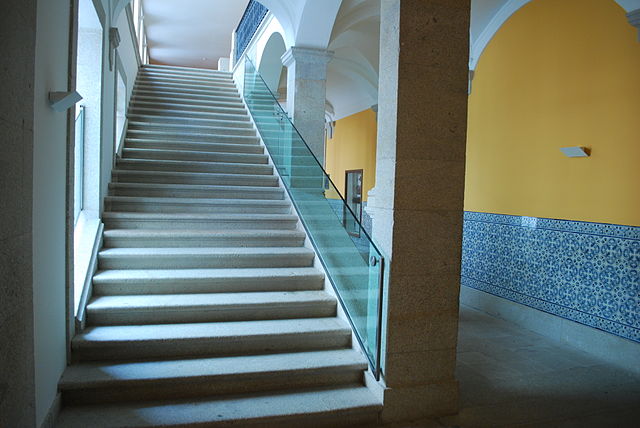
Locate an element on the screen. columns is located at coordinates (413, 208), (301, 96).